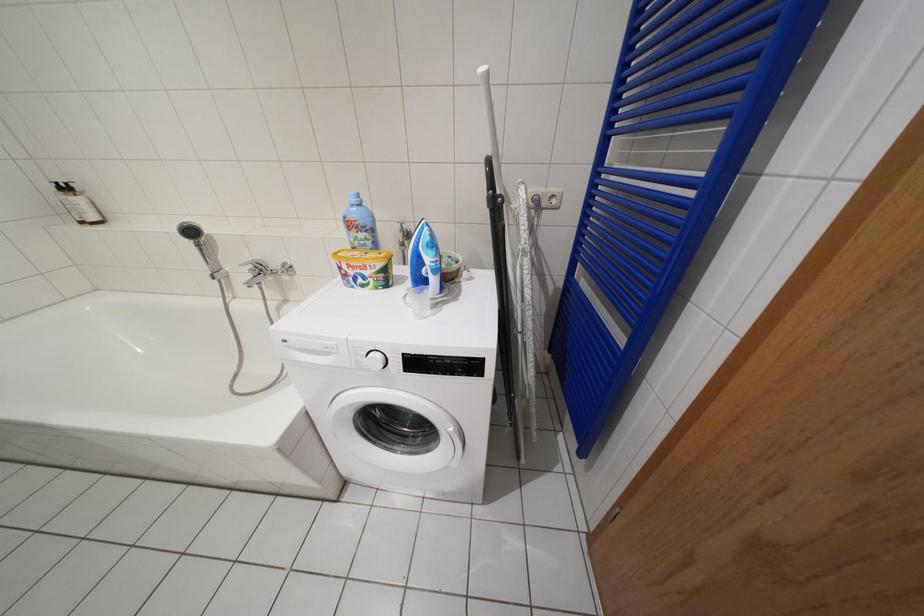
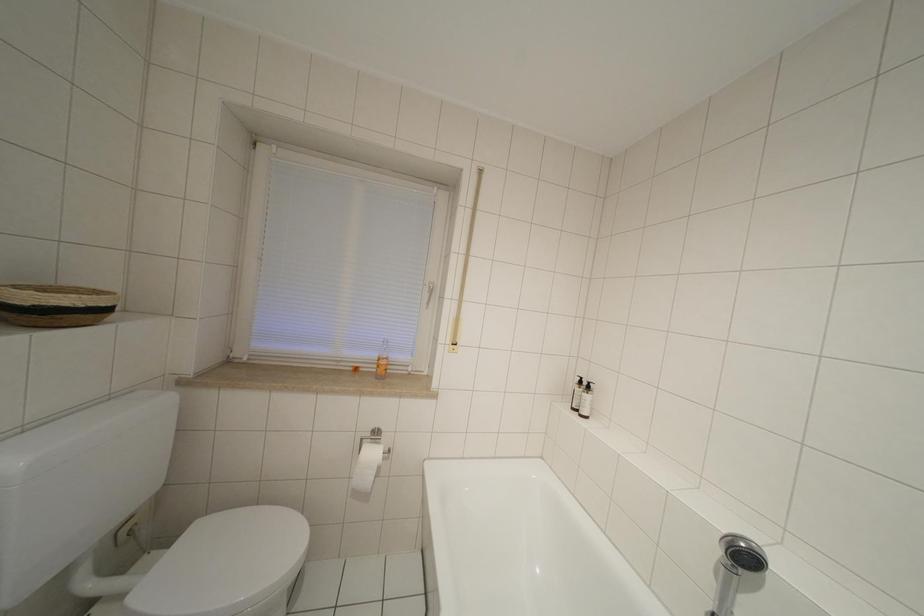
Question: The camera is either moving clockwise (left) or counter-clockwise (right) around the object. The first image is from the beginning of the video and the second image is from the end. Is the camera moving left or right when shooting the video?

Choices:
 (A) Left
 (B) Right

Answer: (B)